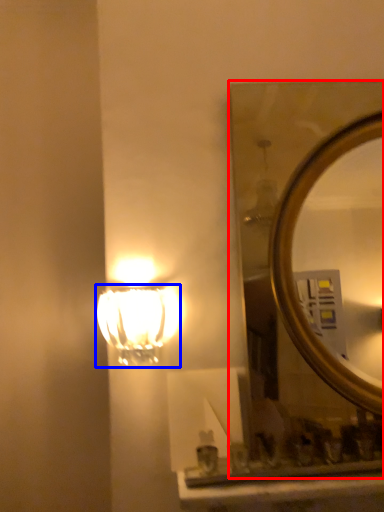
Question: Which object is further to the camera taking this photo, mirror (highlighted by a red box) or lamp (highlighted by a blue box)?

Choices:
 (A) mirror
 (B) lamp

Answer: (A)